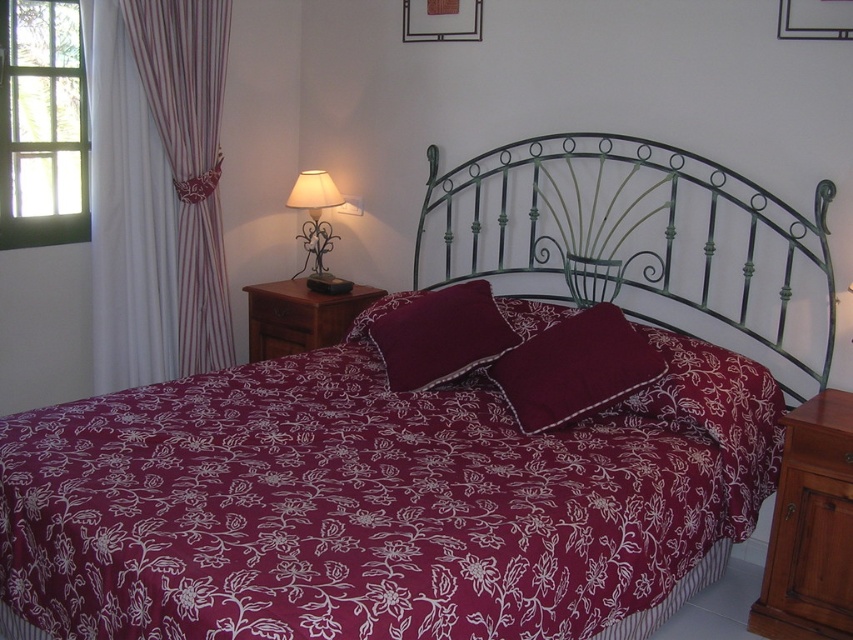
Question: Is green wrought iron headboard at center thinner than maroon fabric pillow at center?

Choices:
 (A) yes
 (B) no

Answer: (B)

Question: Can you confirm if clear glass window at left is smaller than brown wooden dresser at lower right?

Choices:
 (A) yes
 (B) no

Answer: (A)

Question: Which object appears farthest from the camera in this image?

Choices:
 (A) maroon fabric pillow at center
 (B) burgundy satin pillow at center
 (C) brown wood nightstand at left

Answer: (C)

Question: Which point appears farthest from the camera in this image?

Choices:
 (A) (309, 349)
 (B) (782, 552)

Answer: (A)

Question: Is striped fabric curtain at left above brown wood nightstand at left?

Choices:
 (A) no
 (B) yes

Answer: (B)

Question: Among these objects, which one is farthest from the camera?

Choices:
 (A) green wrought iron headboard at center
 (B) burgundy satin pillow at center

Answer: (A)